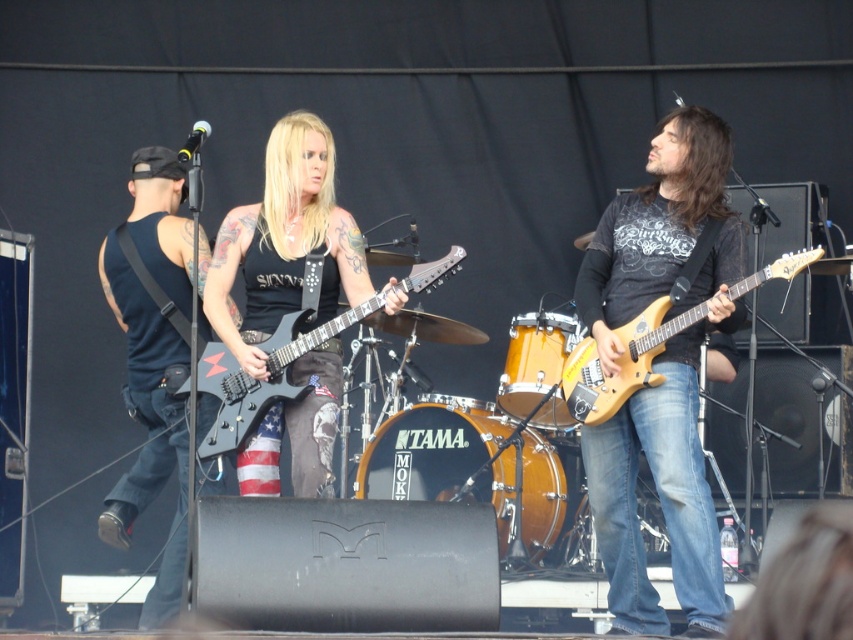
Does point (624, 243) come closer to viewer compared to point (521, 326)?

Yes, point (624, 243) is in front of point (521, 326).

Does matte black guitar at right appear over wooden drum at center?

Correct, matte black guitar at right is located above wooden drum at center.

Find the location of a particular element. The height and width of the screenshot is (640, 853). matte black guitar at right is located at coordinates (660, 369).

Find the location of a particular element. matte black guitar at right is located at coordinates (660, 369).

Which is more to the left, glossy black electric guitar at center or wooden drum at center?

glossy black electric guitar at center

Is glossy black electric guitar at center further to the viewer compared to wooden drum at center?

No.

At what (x,y) coordinates should I click in order to perform the action: click on glossy black electric guitar at center. Please return your answer as a coordinate pair (x, y). The width and height of the screenshot is (853, 640). Looking at the image, I should click on (267, 372).

In order to click on glossy black electric guitar at center in this screenshot , I will do `click(267, 372)`.

Which is behind, point (165, 278) or point (529, 339)?

The point (529, 339) is behind.

Can you confirm if black matte tank top at left is positioned to the right of wooden drum at center?

Incorrect, black matte tank top at left is not on the right side of wooden drum at center.

Does point (200, 272) come behind point (554, 428)?

No, it is not.

I want to click on black matte tank top at left, so click(x=148, y=426).